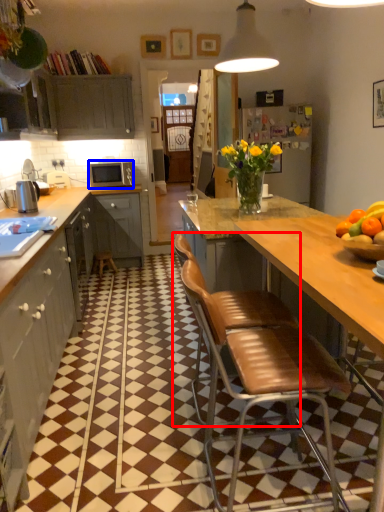
Question: Which object appears farthest to the camera in this image, chair (highlighted by a red box) or microwave oven (highlighted by a blue box)?

Choices:
 (A) chair
 (B) microwave oven

Answer: (B)